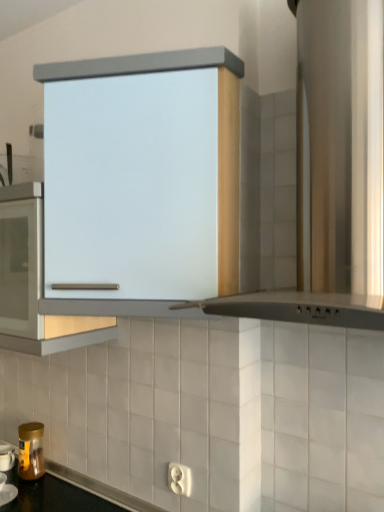
Question: Is gold metallic jar at lower left positioned behind satin white cabinet at center?

Choices:
 (A) yes
 (B) no

Answer: (A)

Question: From the image's perspective, is gold metallic jar at lower left over satin white cabinet at center?

Choices:
 (A) yes
 (B) no

Answer: (B)

Question: From a real-world perspective, is gold metallic jar at lower left beneath satin white cabinet at center?

Choices:
 (A) no
 (B) yes

Answer: (B)

Question: From the image's perspective, would you say gold metallic jar at lower left is shown under satin white cabinet at center?

Choices:
 (A) yes
 (B) no

Answer: (A)

Question: Is gold metallic jar at lower left outside satin white cabinet at center?

Choices:
 (A) no
 (B) yes

Answer: (B)

Question: Does gold metallic jar at lower left touch satin white cabinet at center?

Choices:
 (A) yes
 (B) no

Answer: (B)

Question: Considering the relative positions of gold metallic jar at lower left and satin silver hood at upper center in the image provided, is gold metallic jar at lower left to the left of satin silver hood at upper center from the viewer's perspective?

Choices:
 (A) no
 (B) yes

Answer: (B)

Question: Is gold metallic jar at lower left outside of satin silver hood at upper center?

Choices:
 (A) no
 (B) yes

Answer: (B)

Question: Is gold metallic jar at lower left positioned behind satin silver hood at upper center?

Choices:
 (A) yes
 (B) no

Answer: (A)

Question: Can you confirm if gold metallic jar at lower left is taller than satin silver hood at upper center?

Choices:
 (A) no
 (B) yes

Answer: (A)

Question: Is gold metallic jar at lower left shorter than satin silver hood at upper center?

Choices:
 (A) yes
 (B) no

Answer: (A)

Question: From the image's perspective, is gold metallic jar at lower left under satin silver hood at upper center?

Choices:
 (A) no
 (B) yes

Answer: (B)

Question: Can you confirm if satin silver hood at upper center is positioned to the right of satin white cabinet at center?

Choices:
 (A) yes
 (B) no

Answer: (A)